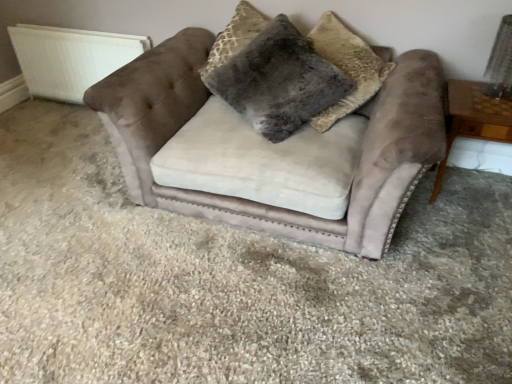
Question: From a real-world perspective, is velvet couch at center physically above white textured radiator at upper left?

Choices:
 (A) no
 (B) yes

Answer: (B)

Question: From a real-world perspective, is velvet couch at center located beneath white textured radiator at upper left?

Choices:
 (A) yes
 (B) no

Answer: (B)

Question: Is velvet couch at center oriented towards white textured radiator at upper left?

Choices:
 (A) no
 (B) yes

Answer: (A)

Question: Considering the relative sizes of velvet couch at center and white textured radiator at upper left in the image provided, is velvet couch at center thinner than white textured radiator at upper left?

Choices:
 (A) no
 (B) yes

Answer: (A)

Question: Does velvet couch at center have a lesser height compared to white textured radiator at upper left?

Choices:
 (A) no
 (B) yes

Answer: (A)

Question: In terms of width, does wooden side table at right look wider or thinner when compared to fuzzy gray pillow at center, which is counted as the 2th pillow, starting from the right?

Choices:
 (A) wide
 (B) thin

Answer: (A)

Question: Is wooden side table at right bigger or smaller than fuzzy gray pillow at center, which is the first pillow from left to right?

Choices:
 (A) small
 (B) big

Answer: (A)

Question: Visually, is wooden side table at right positioned to the left or to the right of fuzzy gray pillow at center, which is the first pillow from left to right?

Choices:
 (A) right
 (B) left

Answer: (A)

Question: Considering the positions of wooden side table at right and fuzzy gray pillow at center, which is the first pillow from left to right, in the image, is wooden side table at right taller or shorter than fuzzy gray pillow at center, which is the first pillow from left to right,?

Choices:
 (A) tall
 (B) short

Answer: (B)

Question: Is velvet couch at center situated inside fuzzy gray pillow at center, which appears as the 2th pillow when viewed from the left, or outside?

Choices:
 (A) inside
 (B) outside

Answer: (B)

Question: From the image's perspective, is velvet couch at center above or below fuzzy gray pillow at center, which appears as the 2th pillow when viewed from the left?

Choices:
 (A) above
 (B) below

Answer: (B)

Question: Visually, is velvet couch at center positioned to the left or to the right of fuzzy gray pillow at center, which appears as the 2th pillow when viewed from the left?

Choices:
 (A) left
 (B) right

Answer: (A)

Question: From their relative heights in the image, would you say velvet couch at center is taller or shorter than fuzzy gray pillow at center, which appears as the 2th pillow when viewed from the left?

Choices:
 (A) short
 (B) tall

Answer: (B)

Question: Based on their sizes in the image, would you say fuzzy gray pillow at center, which is the first pillow from left to right, is bigger or smaller than wooden side table at right?

Choices:
 (A) small
 (B) big

Answer: (B)

Question: From a real-world perspective, is fuzzy gray pillow at center, which is the first pillow from left to right, above or below wooden side table at right?

Choices:
 (A) above
 (B) below

Answer: (A)